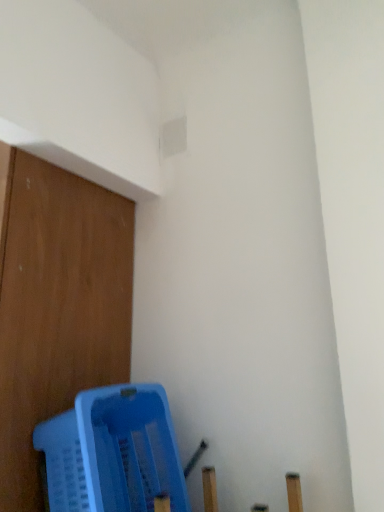
Question: Should I look upward or downward to see blue plastic swivel chair at lower left?

Choices:
 (A) down
 (B) up

Answer: (A)